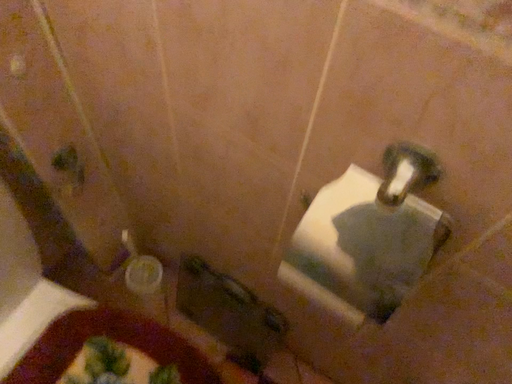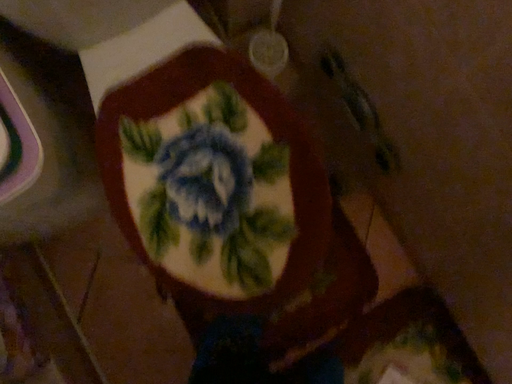
Question: How did the camera likely rotate when shooting the video?

Choices:
 (A) rotated left
 (B) rotated right

Answer: (A)